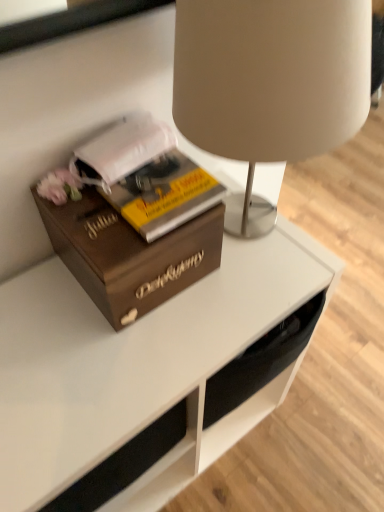
Question: From the image's perspective, is yellow matte book at center positioned above or below white matte book at left?

Choices:
 (A) below
 (B) above

Answer: (A)

Question: From a real-world perspective, relative to white matte book at left, is yellow matte book at center vertically above or below?

Choices:
 (A) above
 (B) below

Answer: (B)

Question: Estimate the real-world distances between objects in this image. Which object is closer to the white matte book at left?

Choices:
 (A) wooden box at left
 (B) matte beige lampshade at upper center
 (C) yellow matte book at center

Answer: (C)

Question: Which is farther from the yellow matte book at center?

Choices:
 (A) matte beige lampshade at upper center
 (B) wooden box at left
 (C) white matte book at left

Answer: (A)